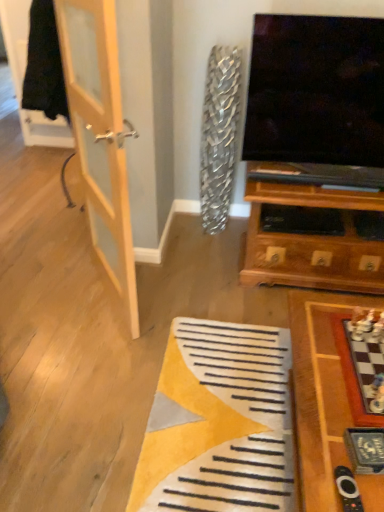
Question: Considering the relative sizes of wooden chessboard at lower right and light wood door at left in the image provided, is wooden chessboard at lower right smaller than light wood door at left?

Choices:
 (A) no
 (B) yes

Answer: (A)

Question: Considering the relative sizes of wooden chessboard at lower right and light wood door at left in the image provided, is wooden chessboard at lower right thinner than light wood door at left?

Choices:
 (A) no
 (B) yes

Answer: (A)

Question: Can you confirm if wooden chessboard at lower right is wider than light wood door at left?

Choices:
 (A) no
 (B) yes

Answer: (B)

Question: Is wooden chessboard at lower right far from light wood door at left?

Choices:
 (A) no
 (B) yes

Answer: (B)

Question: From a real-world perspective, is wooden chessboard at lower right over light wood door at left?

Choices:
 (A) no
 (B) yes

Answer: (A)

Question: Looking at their shapes, would you say light wood door at left is wider or thinner than black plastic remote at lower right?

Choices:
 (A) wide
 (B) thin

Answer: (B)

Question: Is light wood door at left spatially inside black plastic remote at lower right, or outside of it?

Choices:
 (A) outside
 (B) inside

Answer: (A)

Question: Would you say light wood door at left is to the left or to the right of black plastic remote at lower right in the picture?

Choices:
 (A) right
 (B) left

Answer: (B)

Question: From a real-world perspective, is light wood door at left above or below black plastic remote at lower right?

Choices:
 (A) below
 (B) above

Answer: (B)

Question: Is wooden chessboard at lower right wider or thinner than light wood door at left?

Choices:
 (A) thin
 (B) wide

Answer: (B)

Question: Is wooden chessboard at lower right inside or outside of light wood door at left?

Choices:
 (A) outside
 (B) inside

Answer: (A)

Question: Considering the positions of point (307, 331) and point (117, 86), is point (307, 331) closer or farther from the camera than point (117, 86)?

Choices:
 (A) closer
 (B) farther

Answer: (B)

Question: In terms of height, does wooden chessboard at lower right look taller or shorter compared to light wood door at left?

Choices:
 (A) short
 (B) tall

Answer: (A)

Question: In terms of width, does wooden chessboard at lower right look wider or thinner when compared to black plastic remote at lower right?

Choices:
 (A) wide
 (B) thin

Answer: (A)

Question: Does point [332, 497] appear closer or farther from the camera than point [340, 495]?

Choices:
 (A) farther
 (B) closer

Answer: (A)